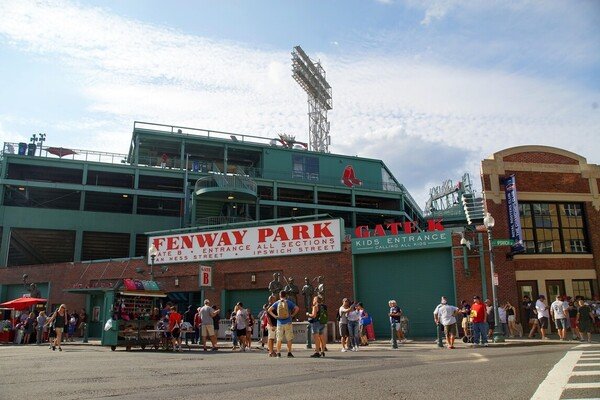
Locate an element on the screen. The width and height of the screenshot is (600, 400). green doors is located at coordinates (395, 285), (251, 302), (95, 305), (18, 290).